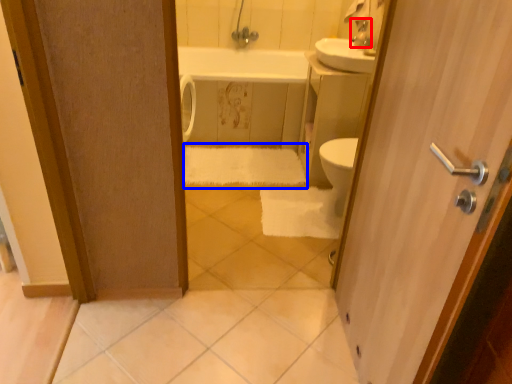
Question: Among these objects, which one is farthest to the camera, faucet (highlighted by a red box) or bath towel (highlighted by a blue box)?

Choices:
 (A) faucet
 (B) bath towel

Answer: (B)